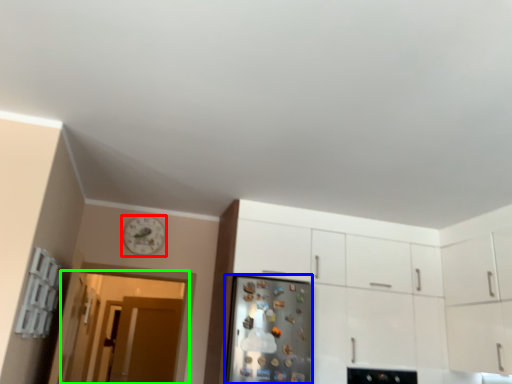
Question: Which object is the farthest from clock (highlighted by a red box)? Choose among these: fridge (highlighted by a blue box) or glass door (highlighted by a green box).

Choices:
 (A) fridge
 (B) glass door

Answer: (A)